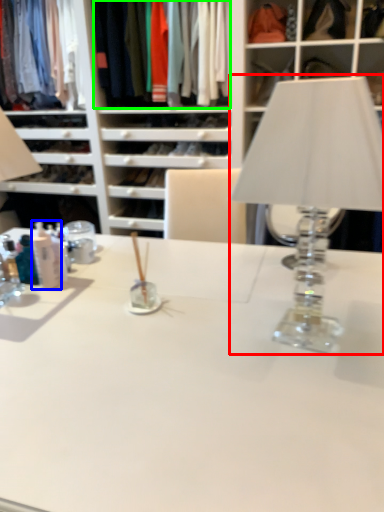
Question: Which is farther away from table lamp (highlighted by a red box)? toiletry (highlighted by a blue box) or clothing (highlighted by a green box)?

Choices:
 (A) toiletry
 (B) clothing

Answer: (B)